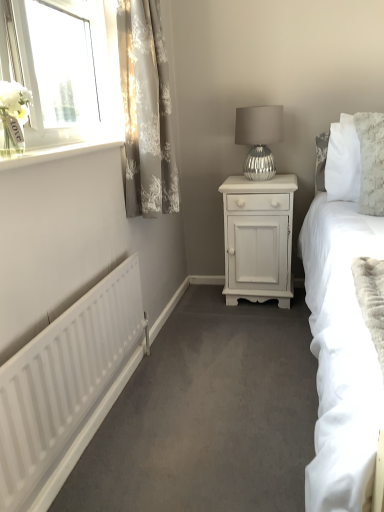
Identify the location of gray floral fabric curtain at upper left. (146, 111).

What do you see at coordinates (258, 238) in the screenshot? I see `white painted wood nightstand at center` at bounding box center [258, 238].

The width and height of the screenshot is (384, 512). What are the coordinates of `white matte radiator at lower left` in the screenshot? It's located at (64, 378).

What are the coordinates of `window sill in front of the white painted wood nightstand at center` in the screenshot? It's located at point(56,152).

Between white painted wood nightstand at center and white painted wood at upper left, which one has smaller width?

white painted wood at upper left.

Considering the positions of objects white painted wood nightstand at center and white painted wood at upper left in the image provided, who is more to the left, white painted wood nightstand at center or white painted wood at upper left?

From the viewer's perspective, white painted wood at upper left appears more on the left side.

Is gray floral fabric curtain at upper left bigger or smaller than silver textured lamp at center?

Considering their sizes, gray floral fabric curtain at upper left takes up more space than silver textured lamp at center.

From a real-world perspective, which is physically above, gray floral fabric curtain at upper left or silver textured lamp at center?

From a 3D spatial view, gray floral fabric curtain at upper left is above.

Which object is closer to the camera taking this photo, gray floral fabric curtain at upper left or silver textured lamp at center?

gray floral fabric curtain at upper left is closer to the camera.

From the image's perspective, is gray floral fabric curtain at upper left beneath silver textured lamp at center?

No, from the image's perspective, gray floral fabric curtain at upper left is not beneath silver textured lamp at center.

You are a GUI agent. You are given a task and a screenshot of the screen. Output one action in this format:
    pyautogui.click(x=<x>, y=<y>)
    Task: Click on the table lamp above the white painted wood nightstand at center (from a real-world perspective)
    The height and width of the screenshot is (512, 384).
    Given the screenshot: What is the action you would take?
    pyautogui.click(x=259, y=138)

Is white painted wood nightstand at center outside of silver textured lamp at center?

Yes, white painted wood nightstand at center is located beyond the bounds of silver textured lamp at center.

From a real-world perspective, relative to silver textured lamp at center, is white painted wood nightstand at center vertically above or below?

white painted wood nightstand at center is below silver textured lamp at center.

Is white painted wood nightstand at center not close to silver textured lamp at center?

No, white painted wood nightstand at center is in close proximity to silver textured lamp at center.

Is gray floral fabric curtain at upper left taller or shorter than white matte radiator at lower left?

gray floral fabric curtain at upper left is taller than white matte radiator at lower left.

Is gray floral fabric curtain at upper left thinner than white matte radiator at lower left?

No, gray floral fabric curtain at upper left is not thinner than white matte radiator at lower left.

Are gray floral fabric curtain at upper left and white matte radiator at lower left far apart?

Actually, gray floral fabric curtain at upper left and white matte radiator at lower left are a little close together.

Can you tell me how much gray floral fabric curtain at upper left and white matte radiator at lower left differ in facing direction?

They differ by 1.04 degrees in their facing directions.

From a real-world perspective, is silver textured lamp at center above or below white painted wood at upper left?

silver textured lamp at center is below white painted wood at upper left.

Looking at this image, considering the sizes of silver textured lamp at center and white painted wood at upper left in the image, is silver textured lamp at center taller or shorter than white painted wood at upper left?

Considering their sizes, silver textured lamp at center has more height than white painted wood at upper left.

How many degrees apart are the facing directions of silver textured lamp at center and white painted wood at upper left?

The angular difference between silver textured lamp at center and white painted wood at upper left is 90 degrees.

Is the depth of white matte radiator at lower left less than that of white painted wood nightstand at center?

Yes, white matte radiator at lower left is closer to the camera.

Is white matte radiator at lower left oriented away from white painted wood nightstand at center?

white matte radiator at lower left does not have its back to white painted wood nightstand at center.

Are white matte radiator at lower left and white painted wood nightstand at center far apart?

white matte radiator at lower left is far away from white painted wood nightstand at center.

Which is more to the right, white matte radiator at lower left or white painted wood nightstand at center?

Positioned to the right is white painted wood nightstand at center.

Which object is positioned more to the left, white matte radiator at lower left or gray floral fabric curtain at upper left?

white matte radiator at lower left is more to the left.

From a real-world perspective, which object rests below the other?

white matte radiator at lower left.

What's the angular difference between white matte radiator at lower left and gray floral fabric curtain at upper left's facing directions?

There is a 1.04-degree angle between the facing directions of white matte radiator at lower left and gray floral fabric curtain at upper left.

Locate an element on the screen. The width and height of the screenshot is (384, 512). radiator that is on the left side of gray floral fabric curtain at upper left is located at coordinates (64, 378).

You are a GUI agent. You are given a task and a screenshot of the screen. Output one action in this format:
    pyautogui.click(x=<x>, y=<y>)
    Task: Click on the nightstand that appears on the right of white painted wood at upper left
    This screenshot has height=512, width=384.
    Given the screenshot: What is the action you would take?
    pyautogui.click(x=258, y=238)

The image size is (384, 512). Find the location of `table lamp behind the gray floral fabric curtain at upper left`. table lamp behind the gray floral fabric curtain at upper left is located at coordinates (259, 138).

From the image, which object appears to be nearer to white painted wood at upper left, white painted wood nightstand at center or silver textured lamp at center?

silver textured lamp at center is positioned closer to the anchor white painted wood at upper left.

Based on their spatial positions, is gray floral fabric curtain at upper left or white painted wood nightstand at center further from white matte radiator at lower left?

white painted wood nightstand at center is positioned further to the anchor white matte radiator at lower left.

Which object lies nearer to the anchor point white painted wood nightstand at center, silver textured lamp at center or white painted wood at upper left?

Among the two, silver textured lamp at center is located nearer to white painted wood nightstand at center.

Considering their positions, is white matte radiator at lower left positioned further to silver textured lamp at center than gray floral fabric curtain at upper left?

Based on the image, white matte radiator at lower left appears to be further to silver textured lamp at center.

Estimate the real-world distances between objects in this image. Which object is further from white painted wood at upper left, white matte radiator at lower left or white painted wood nightstand at center?

white painted wood nightstand at center lies further to white painted wood at upper left than the other object.

Based on the photo, which object lies nearer to the anchor point white matte radiator at lower left, white painted wood at upper left or silver textured lamp at center?

Based on the image, white painted wood at upper left appears to be nearer to white matte radiator at lower left.

Which object lies nearer to the anchor point white matte radiator at lower left, silver textured lamp at center or gray floral fabric curtain at upper left?

gray floral fabric curtain at upper left.

When comparing their distances from gray floral fabric curtain at upper left, does white painted wood at upper left or white painted wood nightstand at center seem further?

Among the two, white painted wood nightstand at center is located further to gray floral fabric curtain at upper left.

What are the coordinates of `window sill between white matte radiator at lower left and silver textured lamp at center in the front-back direction` in the screenshot? It's located at (56, 152).

Image resolution: width=384 pixels, height=512 pixels. In order to click on window sill between gray floral fabric curtain at upper left and white matte radiator at lower left vertically in this screenshot , I will do `click(56, 152)`.

At what (x,y) coordinates should I click in order to perform the action: click on curtain between white matte radiator at lower left and white painted wood nightstand at center in the front-back direction. Please return your answer as a coordinate pair (x, y). This screenshot has width=384, height=512. Looking at the image, I should click on (146, 111).

You are a GUI agent. You are given a task and a screenshot of the screen. Output one action in this format:
    pyautogui.click(x=<x>, y=<y>)
    Task: Click on the table lamp positioned between white painted wood at upper left and white painted wood nightstand at center from near to far
    
    Given the screenshot: What is the action you would take?
    pyautogui.click(x=259, y=138)